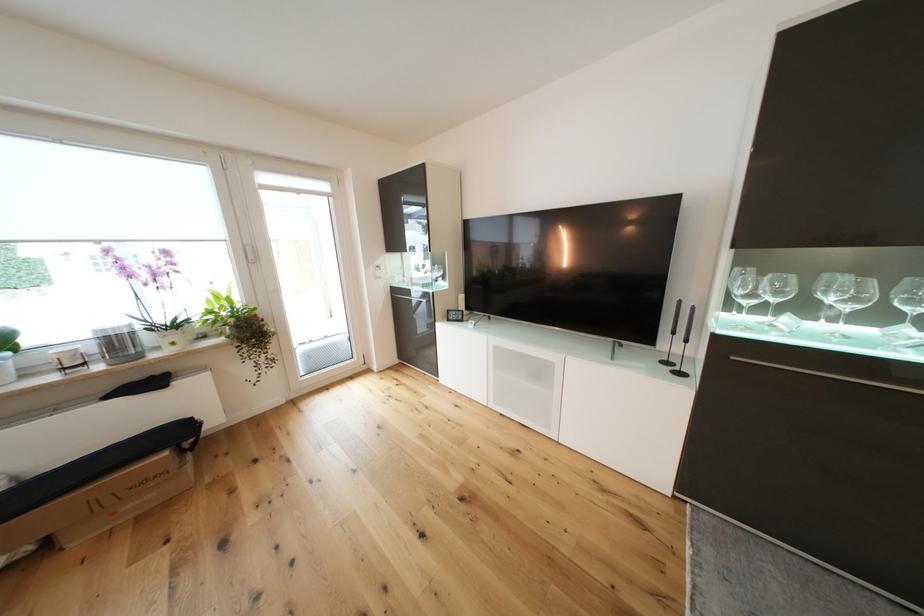
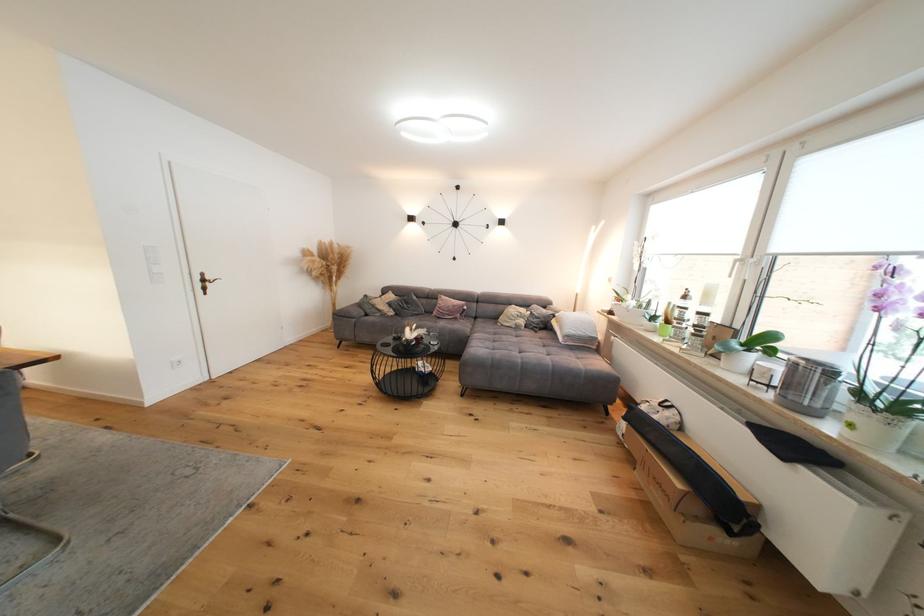
The point at (180, 345) is marked in the first image. Where is the corresponding point in the second image?

(858, 427)